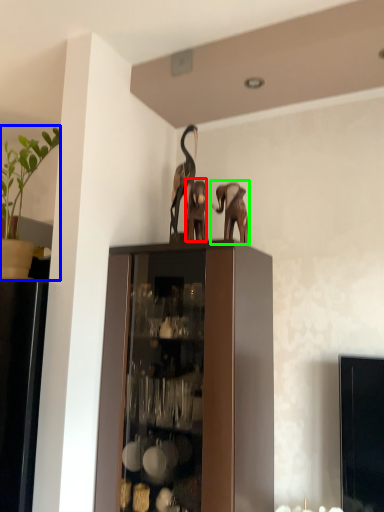
Question: Which object is positioned farthest from animal (highlighted by a red box)? Select from houseplant (highlighted by a blue box) and elephant (highlighted by a green box).

Choices:
 (A) houseplant
 (B) elephant

Answer: (A)